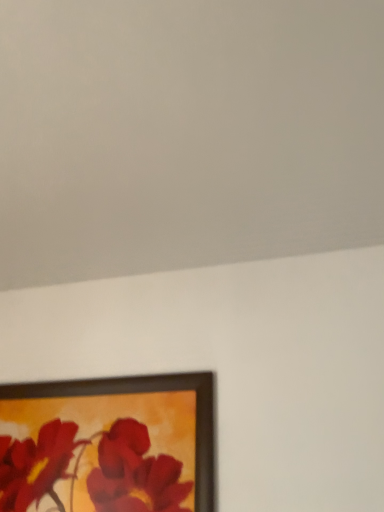
Image resolution: width=384 pixels, height=512 pixels. What do you see at coordinates (109, 445) in the screenshot?
I see `black matte picture frame at lower left` at bounding box center [109, 445].

Locate an element on the screen. black matte picture frame at lower left is located at coordinates (109, 445).

You are a GUI agent. You are given a task and a screenshot of the screen. Output one action in this format:
    pyautogui.click(x=<x>, y=<y>)
    Task: Click on the black matte picture frame at lower left
    This screenshot has height=512, width=384.
    Given the screenshot: What is the action you would take?
    pyautogui.click(x=109, y=445)